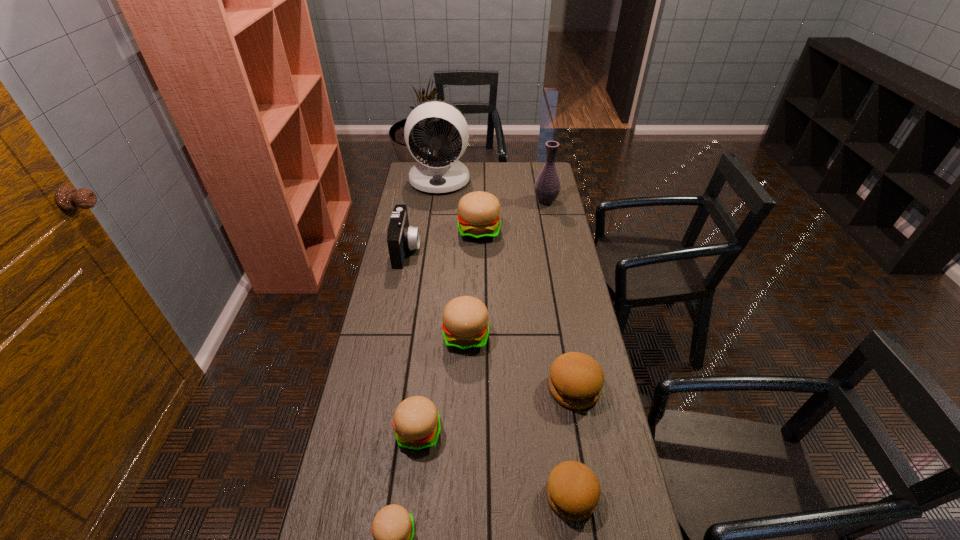
Where is `unoccupied position between the fourth nearest object and the farthest hamburger`? Image resolution: width=960 pixels, height=540 pixels. unoccupied position between the fourth nearest object and the farthest hamburger is located at coordinates (527, 309).

I want to click on vacant area between the camcorder and the bigger brown hamburger, so click(491, 319).

Find the location of `free space between the bigger brown hamburger and the gray fan`. free space between the bigger brown hamburger and the gray fan is located at coordinates (507, 284).

Identify the location of blank region between the smaller brown hamburger and the bigger brown hamburger. The height and width of the screenshot is (540, 960). (572, 442).

Select which object is the second closest to the farthest beige hamburger. Please provide its 2D coordinates. Your answer should be formatted as a tuple, i.e. [(x, y)], where the tuple contains the x and y coordinates of a point satisfying the conditions above.

[(547, 186)]

Find the location of a particular element. The width and height of the screenshot is (960, 540). object that is the sixth closest to the third farthest beige hamburger is located at coordinates (478, 217).

Point out which hamburger is positioned as the fourth nearest to the nearer brown hamburger. Please provide its 2D coordinates. Your answer should be formatted as a tuple, i.e. [(x, y)], where the tuple contains the x and y coordinates of a point satisfying the conditions above.

[(465, 326)]

Identify which hamburger is the fourth closest to the smallest beige hamburger. Please provide its 2D coordinates. Your answer should be formatted as a tuple, i.e. [(x, y)], where the tuple contains the x and y coordinates of a point satisfying the conditions above.

[(465, 326)]

Identify which beige hamburger is the second closest to the farthest hamburger. Please provide its 2D coordinates. Your answer should be formatted as a tuple, i.e. [(x, y)], where the tuple contains the x and y coordinates of a point satisfying the conditions above.

[(416, 421)]

At what (x,y) coordinates should I click in order to perform the action: click on beige hamburger that is the second closest to the farther brown hamburger. Please return your answer as a coordinate pair (x, y). The image size is (960, 540). Looking at the image, I should click on (416, 421).